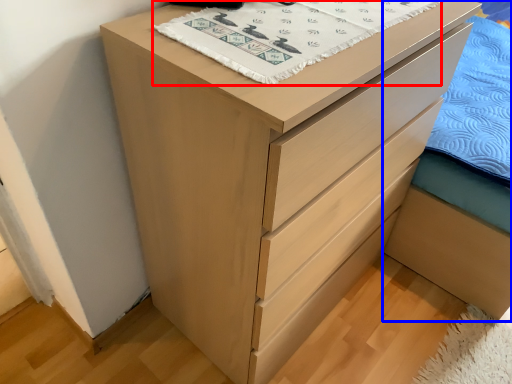
Question: Which object is further to the camera taking this photo, blanket (highlighted by a red box) or bed frame (highlighted by a blue box)?

Choices:
 (A) blanket
 (B) bed frame

Answer: (B)